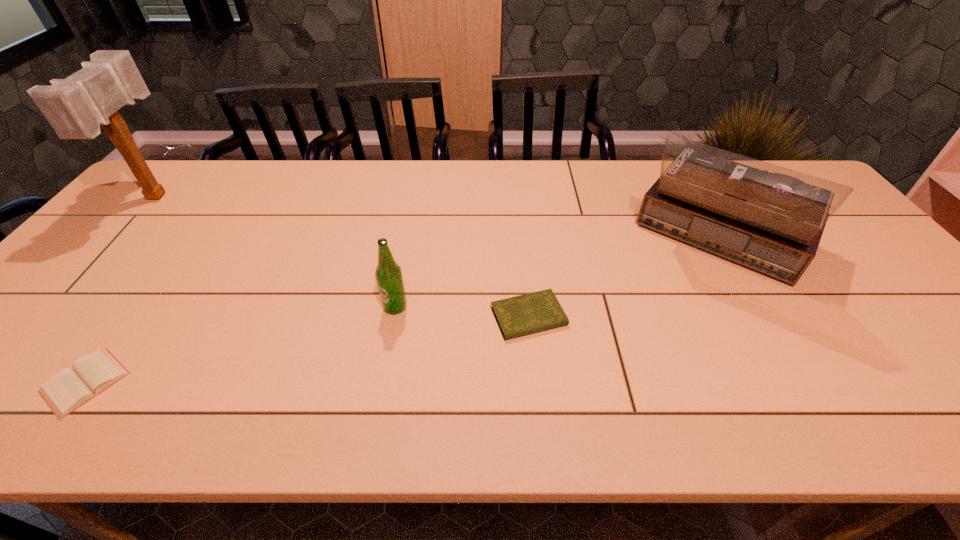
Where is `vacant area that lies between the farther diary and the leftmost object`? vacant area that lies between the farther diary and the leftmost object is located at coordinates (344, 256).

Where is `free spot between the fourth object from left to right and the rightmost object`? This screenshot has height=540, width=960. free spot between the fourth object from left to right and the rightmost object is located at coordinates (623, 280).

Image resolution: width=960 pixels, height=540 pixels. I want to click on free space between the nearer diary and the right diary, so click(x=307, y=349).

The image size is (960, 540). I want to click on vacant space that is in between the third object from right to left and the rightmost object, so click(557, 275).

Where is `empty space between the third tallest object and the right diary`? Image resolution: width=960 pixels, height=540 pixels. empty space between the third tallest object and the right diary is located at coordinates (462, 312).

Identify which object is located as the fourth nearest to the right diary. Please provide its 2D coordinates. Your answer should be formatted as a tuple, i.e. [(x, y)], where the tuple contains the x and y coordinates of a point satisfying the conditions above.

[(75, 107)]

Where is `the third closest object relative to the beer bottle`? This screenshot has height=540, width=960. the third closest object relative to the beer bottle is located at coordinates (769, 218).

Locate an element on the screen. free space that satisfies the following two spatial constraints: 1. on the back side of the rightmost object; 2. on the left side of the farther diary is located at coordinates click(521, 243).

Find the location of a particular element. The image size is (960, 540). free space that satisfies the following two spatial constraints: 1. on the label of the beer bottle; 2. on the left side of the farther diary is located at coordinates (394, 317).

The image size is (960, 540). I want to click on free space that satisfies the following two spatial constraints: 1. on the label of the second object from right to left; 2. on the right side of the third tallest object, so click(x=394, y=317).